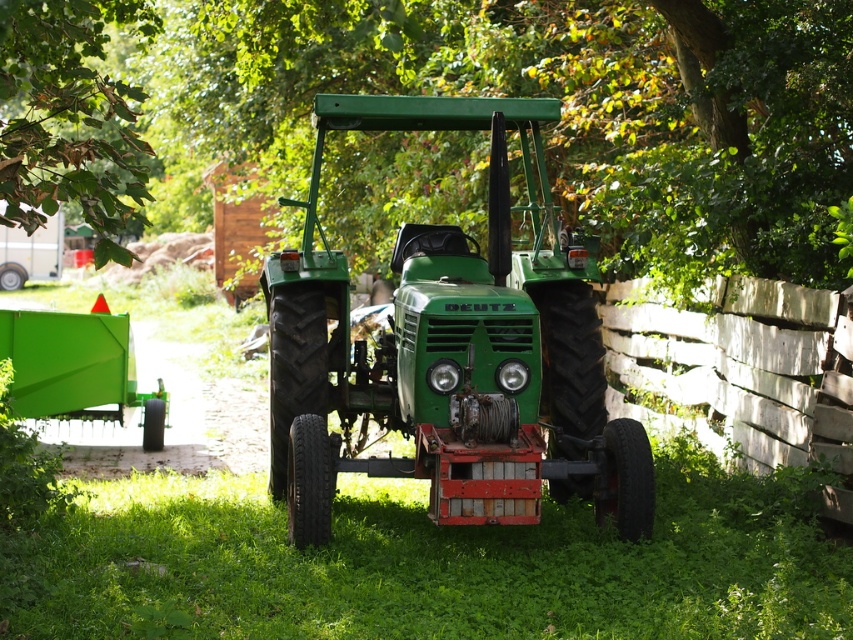
Question: In this image, where is green leafy tree at upper center located relative to green matte tractor at center?

Choices:
 (A) below
 (B) above

Answer: (B)

Question: Among these objects, which one is nearest to the camera?

Choices:
 (A) green matte tractor at center
 (B) green leafy tree at upper center

Answer: (B)

Question: Among these objects, which one is farthest from the camera?

Choices:
 (A) green grass at center
 (B) green leafy tree at upper center
 (C) green matte tractor at center

Answer: (C)

Question: Can you confirm if green matte tractor at center is positioned below green leafy tree at upper left?

Choices:
 (A) no
 (B) yes

Answer: (B)

Question: Can you confirm if green leafy tree at upper center is bigger than green leafy tree at upper left?

Choices:
 (A) no
 (B) yes

Answer: (B)

Question: Which point is closer to the camera?

Choices:
 (A) (39, 129)
 (B) (402, 84)
 (C) (581, 465)

Answer: (A)